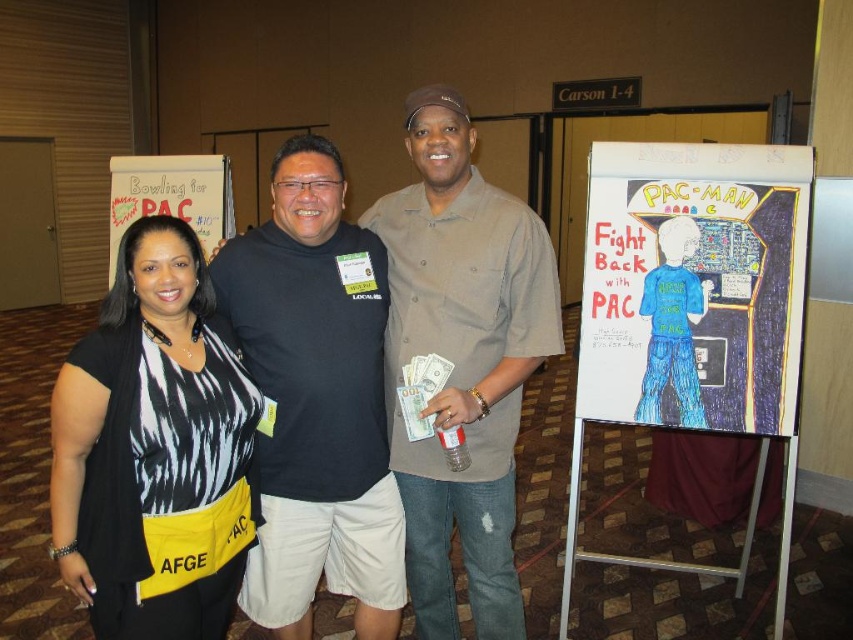
You are a photographer standing at the camera position. You need to take a photo of the black and white printed shirt at center. The camera has a focal length of 50mm. What is the minimum distance you need to move backward to focus on the shirt?

The black and white printed shirt at center is 1.55 meters from the camera. To focus on it with a 50mm lens, you need to ensure the subject is within the camera sensor plane distance. However, standard focusing doesn photography typically require moving backward for such distances. The shirt is already 1.55 meters away, which is within typical focusing range. No backward movement is needed as modern cameras can focus at that distance.

You are at a conference and need to locate the matte khaki shirt at center. Where should you look relative to the white paper poster at upper left?

The matte khaki shirt at center is located below the white paper poster at upper left.

You are organizing a photo shoot and need to arrange two shirts on a mannequin. The black and white printed shirt at center and the black cotton shirt at center are available. If you want the smaller shirt to be on top, which shirt should you place first?

The black and white printed shirt at center is smaller than the black cotton shirt at center, so you should place the black and white printed shirt at center first on top.